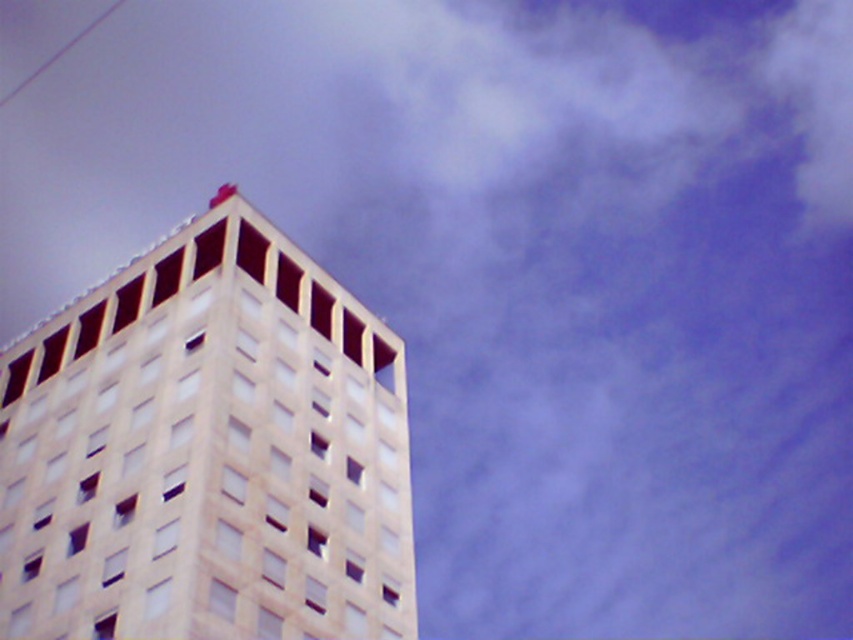
Question: Is white stone building at upper left positioned in front of smooth white wire at upper left?

Choices:
 (A) no
 (B) yes

Answer: (B)

Question: Which of the following is the closest to the observer?

Choices:
 (A) smooth white wire at upper left
 (B) white stone building at upper left

Answer: (B)

Question: Can you confirm if white stone building at upper left is wider than smooth white wire at upper left?

Choices:
 (A) yes
 (B) no

Answer: (B)

Question: Which point is closer to the camera?

Choices:
 (A) smooth white wire at upper left
 (B) white stone building at upper left

Answer: (B)

Question: Which of the following is the closest to the observer?

Choices:
 (A) (27, 83)
 (B) (115, 480)

Answer: (B)

Question: Can you confirm if white stone building at upper left is thinner than smooth white wire at upper left?

Choices:
 (A) no
 (B) yes

Answer: (B)